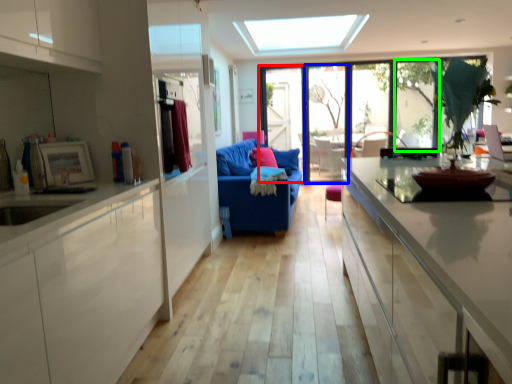
Question: Which object is positioned closest to screen door (highlighted by a red box)? Select from glass door (highlighted by a blue box) and window (highlighted by a green box).

Choices:
 (A) glass door
 (B) window

Answer: (A)